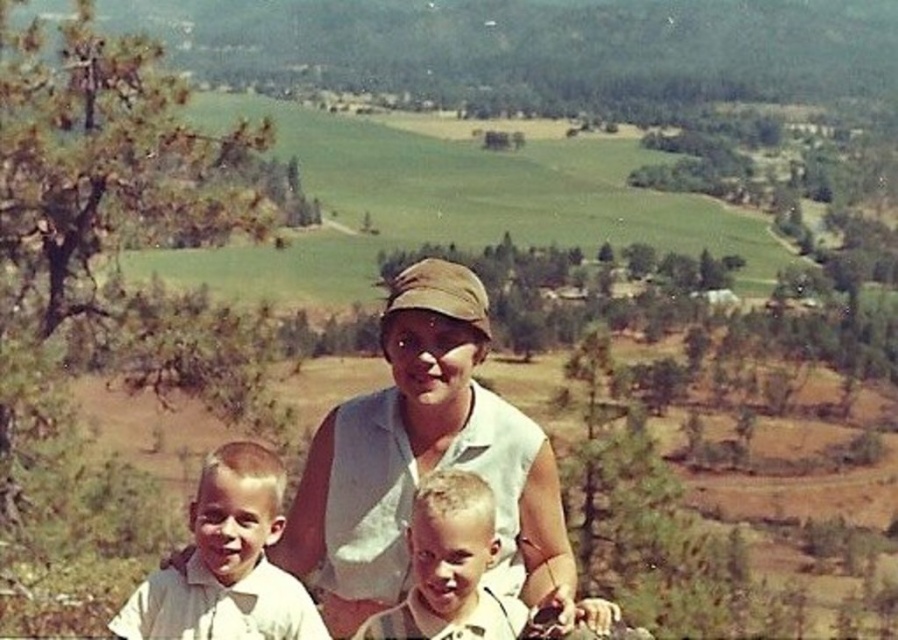
Question: Which point is farther from the camera taking this photo?

Choices:
 (A) (439, 342)
 (B) (192, 586)

Answer: (A)

Question: Is white cotton shirt at center wider than white cotton shirt at left?

Choices:
 (A) yes
 (B) no

Answer: (B)

Question: Which is farther from the light brown hair at center?

Choices:
 (A) white cotton shirt at left
 (B) white cotton shirt at center

Answer: (A)

Question: Which object is the closest to the white cotton shirt at center?

Choices:
 (A) light brown hair at center
 (B) white cotton shirt at left

Answer: (A)

Question: Is white cotton shirt at center wider than light brown hair at center?

Choices:
 (A) no
 (B) yes

Answer: (B)

Question: Does white cotton shirt at center appear over white cotton shirt at left?

Choices:
 (A) yes
 (B) no

Answer: (A)